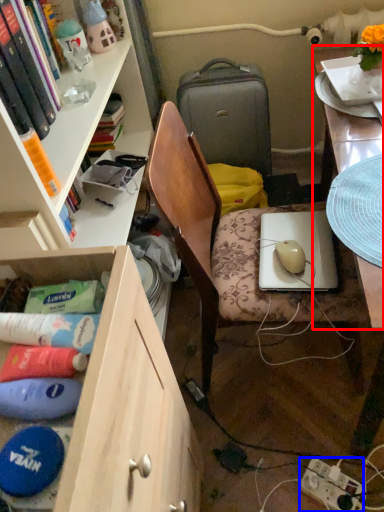
Question: Which of the following is the farthest to the observer, desk (highlighted by a red box) or power outlet (highlighted by a blue box)?

Choices:
 (A) desk
 (B) power outlet

Answer: (B)